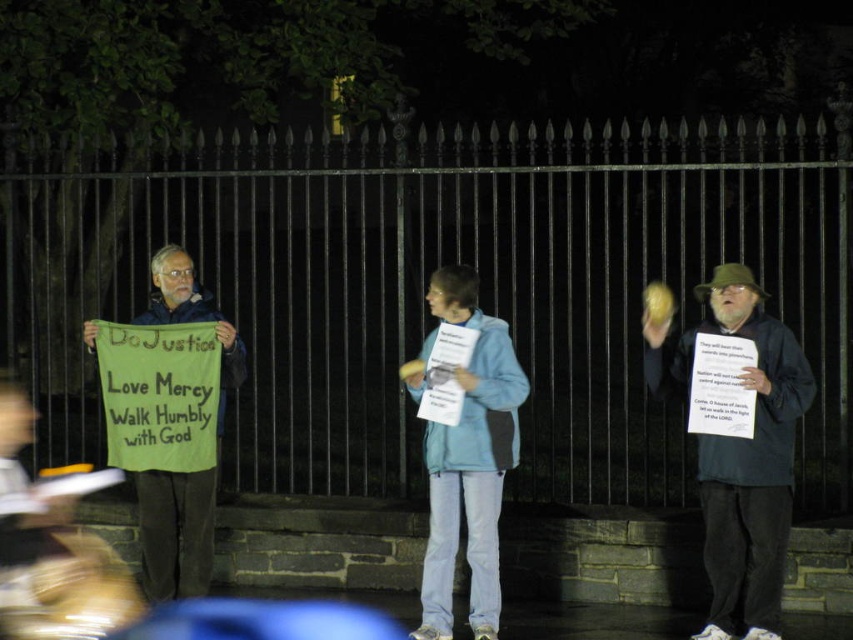
Question: Among these points, which one is farthest from the camera?

Choices:
 (A) (212, 140)
 (B) (440, 566)

Answer: (A)

Question: Does blue fabric sign at center have a larger size compared to green fabric sign at left?

Choices:
 (A) yes
 (B) no

Answer: (A)

Question: Does blue fabric sign at right have a larger size compared to blue fabric sign at center?

Choices:
 (A) yes
 (B) no

Answer: (B)

Question: Which object is the farthest from the green fabric sign at left?

Choices:
 (A) black metal fence at center
 (B) blue fabric sign at right
 (C) blue fabric sign at center

Answer: (A)

Question: Can you confirm if blue fabric sign at right is wider than blue fabric sign at center?

Choices:
 (A) no
 (B) yes

Answer: (B)

Question: Which of the following is the closest to the observer?

Choices:
 (A) (61, 275)
 (B) (657, 362)

Answer: (B)